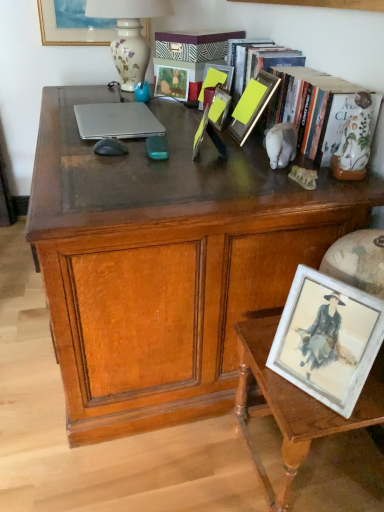
At what (x,y) coordinates should I click in order to perform the action: click on vacant area that is in front of yellow matte picture frame at center, which is counted as the 6th picture frame, starting from the back. Please return your answer as a coordinate pair (x, y). This screenshot has height=512, width=384. Looking at the image, I should click on (231, 163).